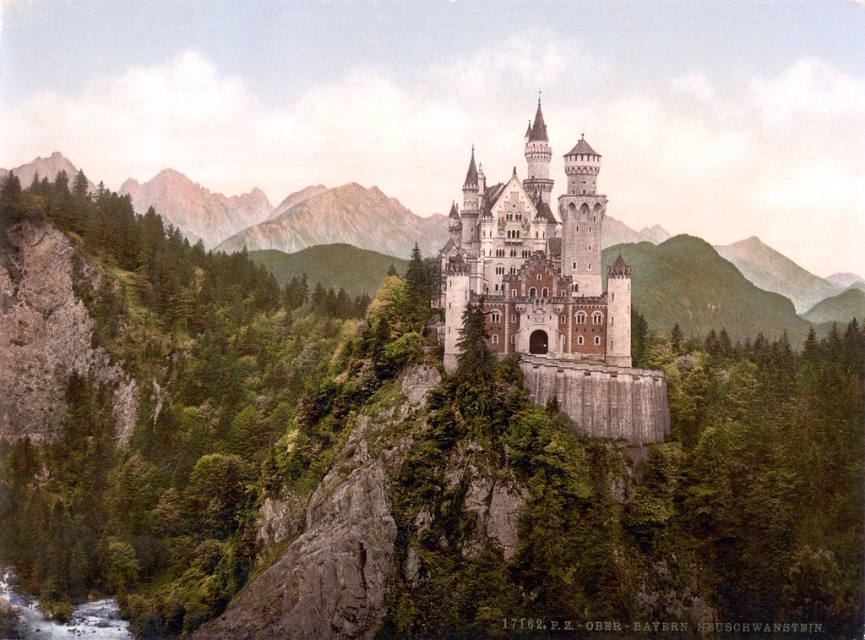
Does point (312, 211) come closer to viewer compared to point (598, 156)?

No, it is behind (598, 156).

Between point (133, 186) and point (585, 321), which one is positioned in front?

Point (585, 321) is more forward.

Find the location of a particular element. This screenshot has width=865, height=640. green rocky cliff at left is located at coordinates (727, 285).

At what (x,y) coordinates should I click in order to perform the action: click on green rocky cliff at left. Please return your answer as a coordinate pair (x, y). Image resolution: width=865 pixels, height=640 pixels. Looking at the image, I should click on (727, 285).